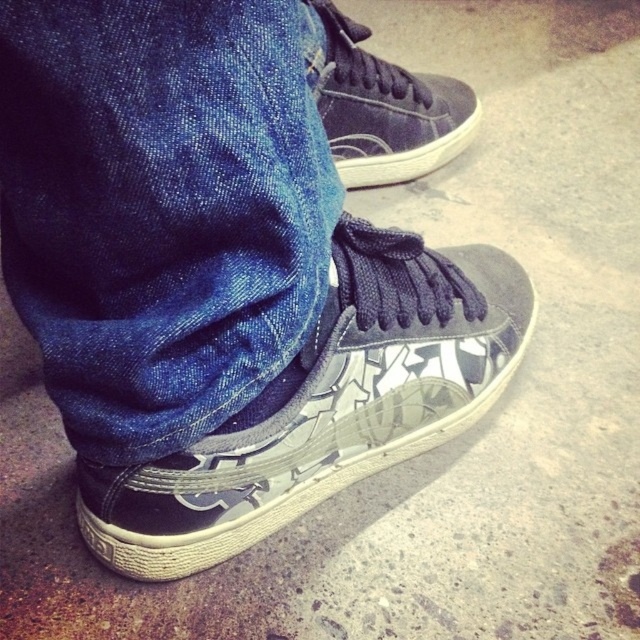
You are a photographer adjusting the focus on your camera. You want to capture both the denim at center and the glossy leather sneaker at lower center clearly in the photo. Which object should you focus on first to ensure the other remains in focus?

You should focus on the denim at center first since it is closer to the viewer than the glossy leather sneaker at lower center, allowing the sneaker to stay in focus as well due to depth of field.

From the picture: You are standing in front of the image and want to touch the denim at center and the matte black sneaker at center. Which object should you reach for first if you want to touch the one on the left first?

The denim at center is to the left of the matte black sneaker at center, so you should reach for the denim at center first.

You are a photographer trying to capture the glossy leather sneaker at lower center and the matte black sneaker at center. Which sneaker will appear larger in the photo due to its position?

The glossy leather sneaker at lower center will appear larger in the photo because it is closer to the viewer than the matte black sneaker at center.